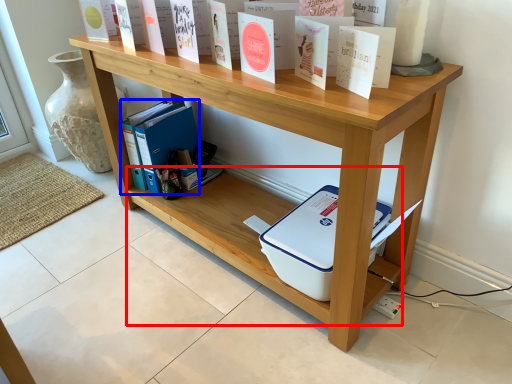
Question: Among these objects, which one is farthest to the camera, shelf (highlighted by a red box) or book (highlighted by a blue box)?

Choices:
 (A) shelf
 (B) book

Answer: (B)